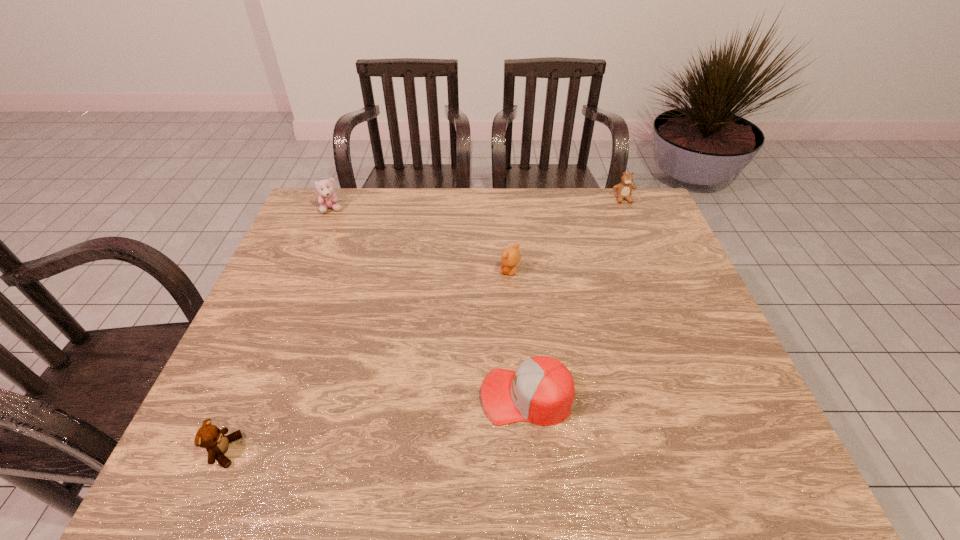
Find the location of a particular element. Image resolution: width=960 pixels, height=540 pixels. free space located on the front-facing side of the fourth farthest object is located at coordinates (413, 396).

Find the location of a particular element. The image size is (960, 540). vacant space situated on the front-facing side of the fourth farthest object is located at coordinates (318, 396).

This screenshot has width=960, height=540. I want to click on vacant space situated 0.380m on the front-facing side of the nearest teddy bear, so click(427, 451).

Find the location of a particular element. The image size is (960, 540). object at the near edge is located at coordinates (209, 436).

Locate an element on the screen. object that is at the right edge is located at coordinates (624, 189).

Locate an element on the screen. The image size is (960, 540). object situated at the far left corner is located at coordinates (327, 199).

This screenshot has height=540, width=960. Identify the location of object located in the near left corner section of the desktop. pos(209,436).

Locate an element on the screen. The height and width of the screenshot is (540, 960). object that is at the far right corner is located at coordinates [x=624, y=189].

Identify the location of free location at the far edge of the desktop. This screenshot has height=540, width=960. (369, 200).

Locate an element on the screen. This screenshot has width=960, height=540. vacant space at the near edge of the desktop is located at coordinates coord(405,465).